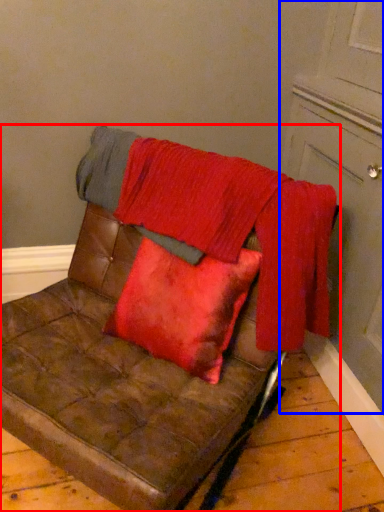
Question: Which of the following is the closest to the observer, furniture (highlighted by a red box) or door (highlighted by a blue box)?

Choices:
 (A) furniture
 (B) door

Answer: (A)